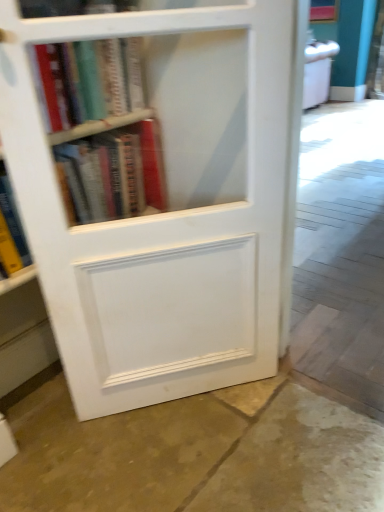
Question: From the image's perspective, is hardcover book at upper left, acting as the 1th book starting from the top, located above or below white matte bookcase at center?

Choices:
 (A) below
 (B) above

Answer: (B)

Question: Is hardcover book at upper left, acting as the 1th book starting from the top, taller or shorter than white matte bookcase at center?

Choices:
 (A) short
 (B) tall

Answer: (A)

Question: Considering the real-world distances, which object is farthest from the hardcover books at upper left, placed as the 2th book when sorted from top to bottom?

Choices:
 (A) brown stone floor at lower center
 (B) white matte bookcase at center
 (C) hardcover book at upper left, the second book positioned from the bottom

Answer: (A)

Question: Which is nearer to the white matte bookcase at center?

Choices:
 (A) brown stone floor at lower center
 (B) hardcover book at upper left, acting as the 1th book starting from the top
 (C) hardcover books at upper left, placed as the 2th book when sorted from top to bottom

Answer: (C)